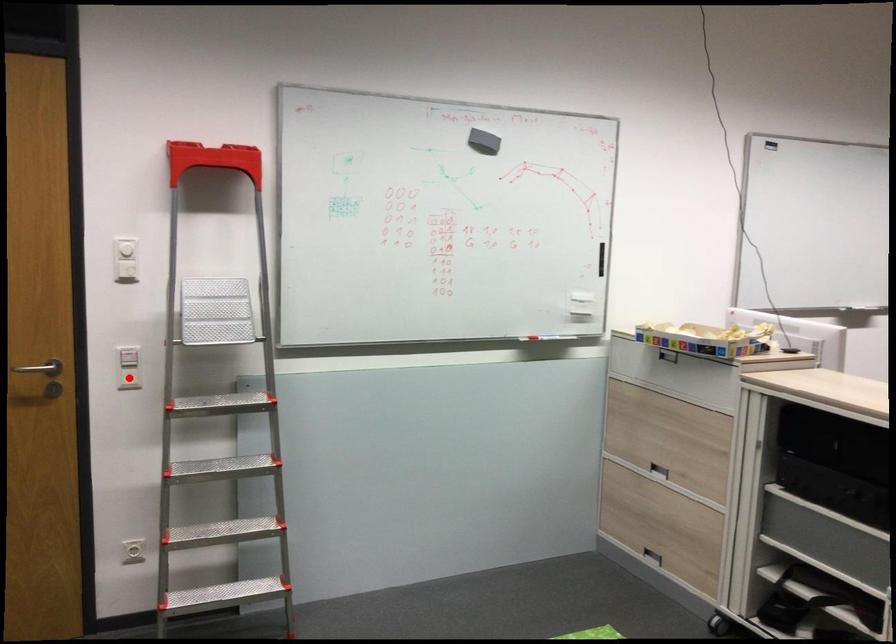
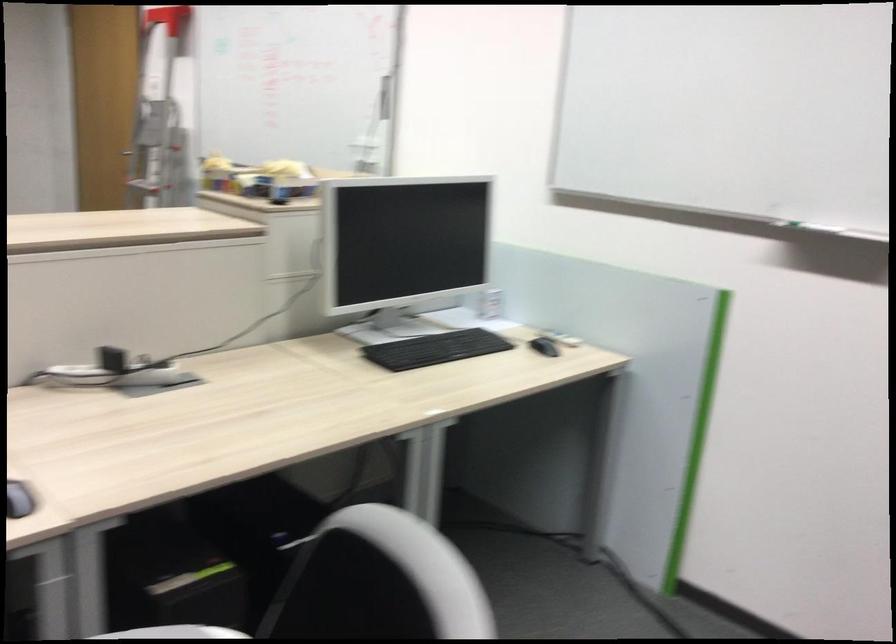
Question: I am providing you with two images of the same scene from different viewpoints. A red point is marked on the first image. At the location where the point appears in image 1, is it still visible in image 2?

Choices:
 (A) Yes
 (B) No

Answer: (B)